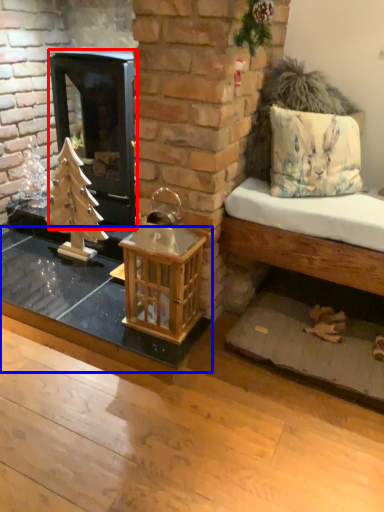
Question: Which object appears farthest to the camera in this image, wood burning stove (highlighted by a red box) or table (highlighted by a blue box)?

Choices:
 (A) wood burning stove
 (B) table

Answer: (A)